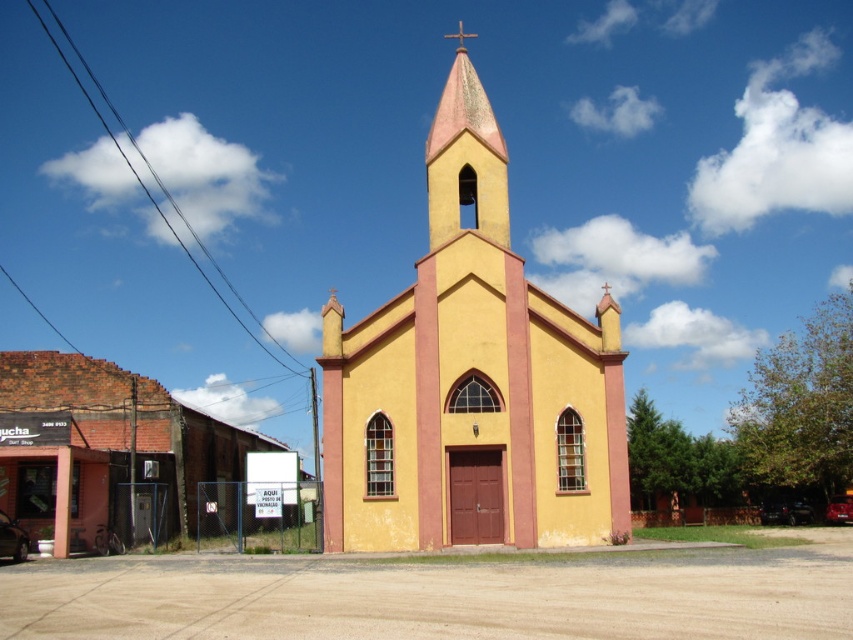
Question: Which of the following is the closest to the observer?

Choices:
 (A) brick building at lower left
 (B) pink matte steeple at center

Answer: (A)

Question: Can you confirm if yellow matte church at center is wider than brick building at lower left?

Choices:
 (A) yes
 (B) no

Answer: (B)

Question: Considering the relative positions of yellow matte church at center and pink matte steeple at center in the image provided, where is yellow matte church at center located with respect to pink matte steeple at center?

Choices:
 (A) left
 (B) right

Answer: (B)

Question: Does brick building at lower left appear over pink matte steeple at center?

Choices:
 (A) no
 (B) yes

Answer: (A)

Question: Which is farther from the pink matte steeple at center?

Choices:
 (A) brick building at lower left
 (B) yellow matte church at center

Answer: (A)

Question: Which point is farther to the camera?

Choices:
 (A) pink matte steeple at center
 (B) brick building at lower left

Answer: (A)